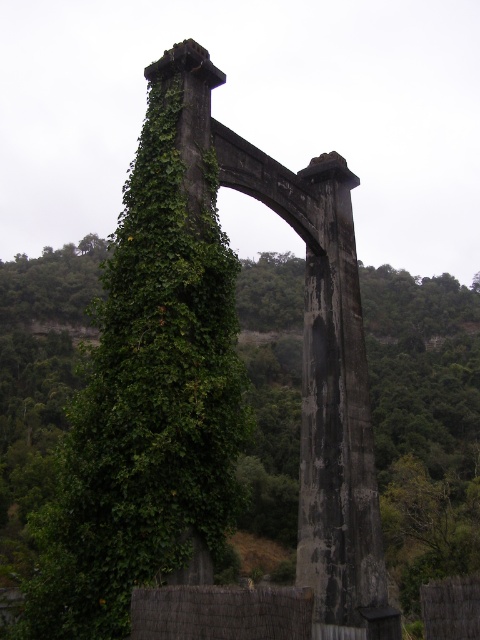
You are an architect inspecting the structure of the archway. From your vantage point, which object is closer to you between the green leafy ivy at center and the dark gray concrete pillar at center?

The green leafy ivy at center is closer to you because the dark gray concrete pillar at center is positioned behind it.

You are standing at the base of the stone archway and want to take a photo of the point at coordinates (376, 376). Your camera has a maximum focus range of 150 meters. Will the camera be able to focus on the point?

The point at coordinates (376, 376) is 145.37 meters from the camera, which is within the 150 meters maximum focus range. Therefore, the camera should be able to focus on the point.

You are standing in front of the archway and want to place a small statue exactly between the green leafy ivy at center and the dark gray concrete pillar at center. Which direction should you move from the pillar to place the statue?

You should move to the right from the dark gray concrete pillar at center because the green leafy ivy at center is located to the left of it, so placing the statue between them would require positioning it to the right of the pillar but left of the ivy.